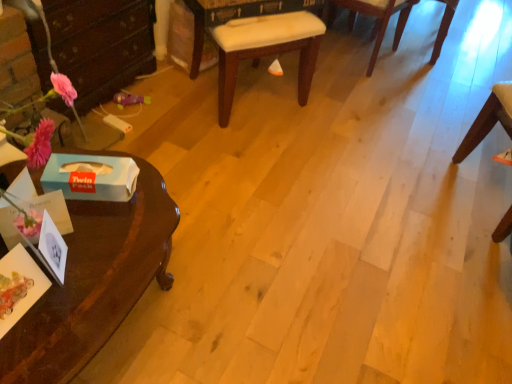
Image resolution: width=512 pixels, height=384 pixels. Find the location of `vacant space to the right of blue paper tissue box at left, positioned as the 1th box in front-to-back order`. vacant space to the right of blue paper tissue box at left, positioned as the 1th box in front-to-back order is located at coordinates (100, 237).